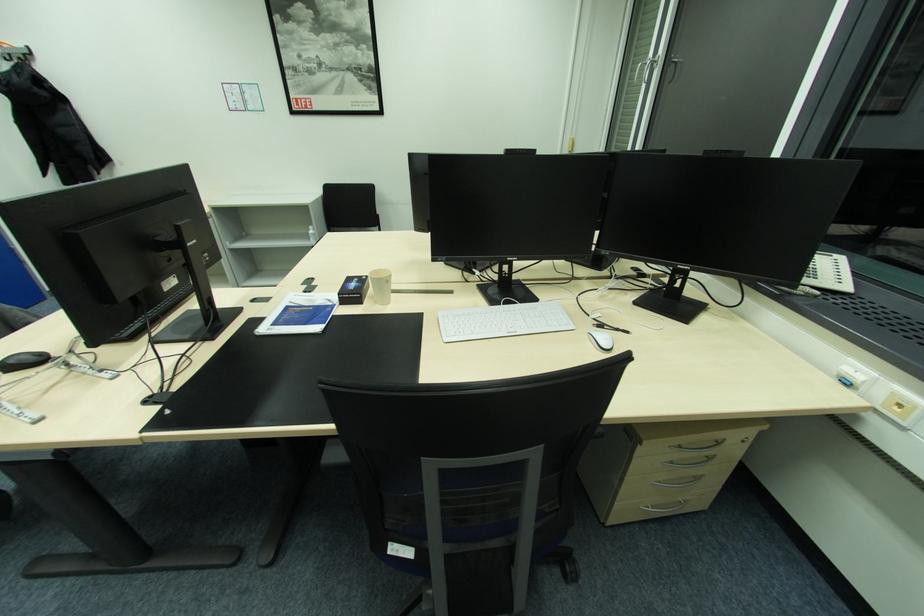
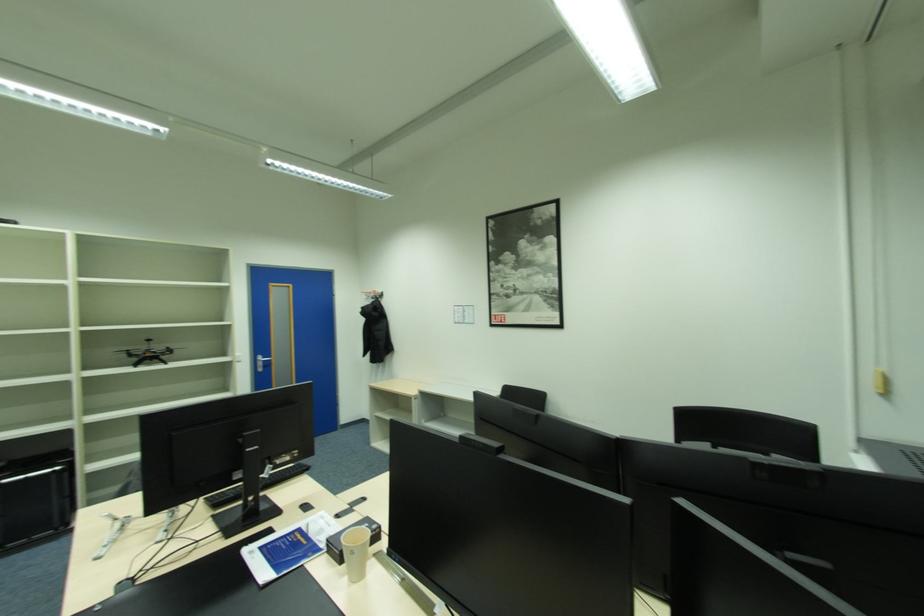
First-person continuous shooting, in which direction is the camera rotating?

The rotation direction of the camera is left-up.